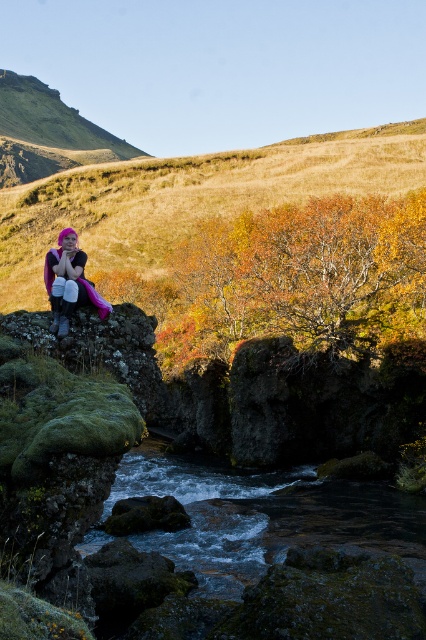
Between dark gray rocky stream at center and pink fabric at left, which one is positioned higher?

pink fabric at left is above.

Which is behind, point (215, 541) or point (55, 317)?

Positioned behind is point (215, 541).

Where is `dark gray rocky stream at center`? dark gray rocky stream at center is located at coordinates (264, 516).